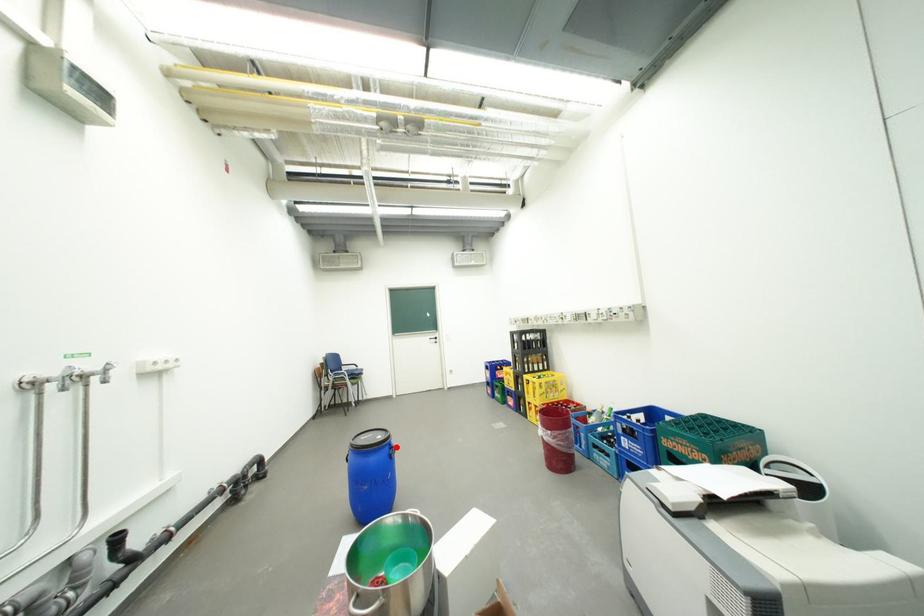
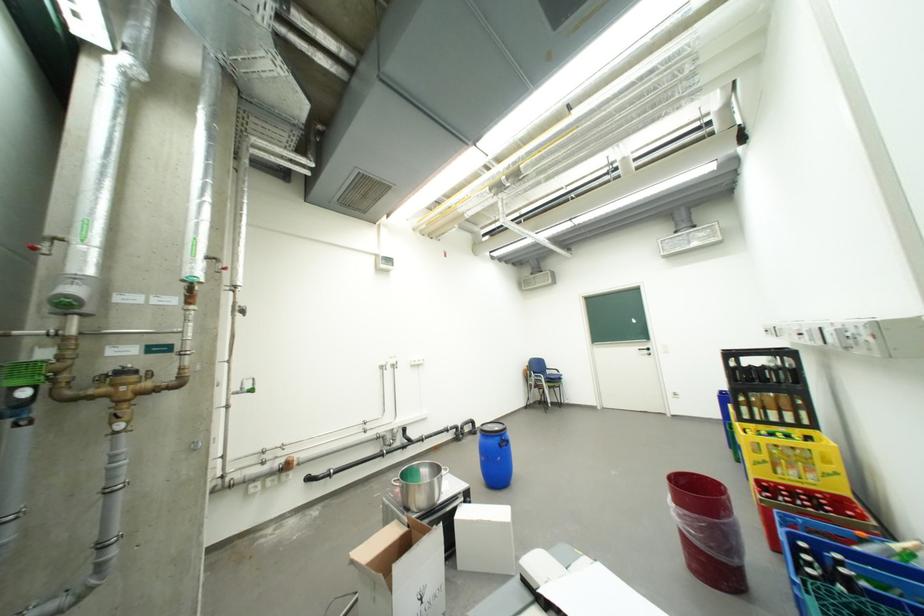
Question: I am providing you with two images of the same scene from different viewpoints. Given a red point in image1, look at the same physical point in image2. Is it:

Choices:
 (A) Closer to the viewpoint
 (B) Farther from the viewpoint

Answer: (B)